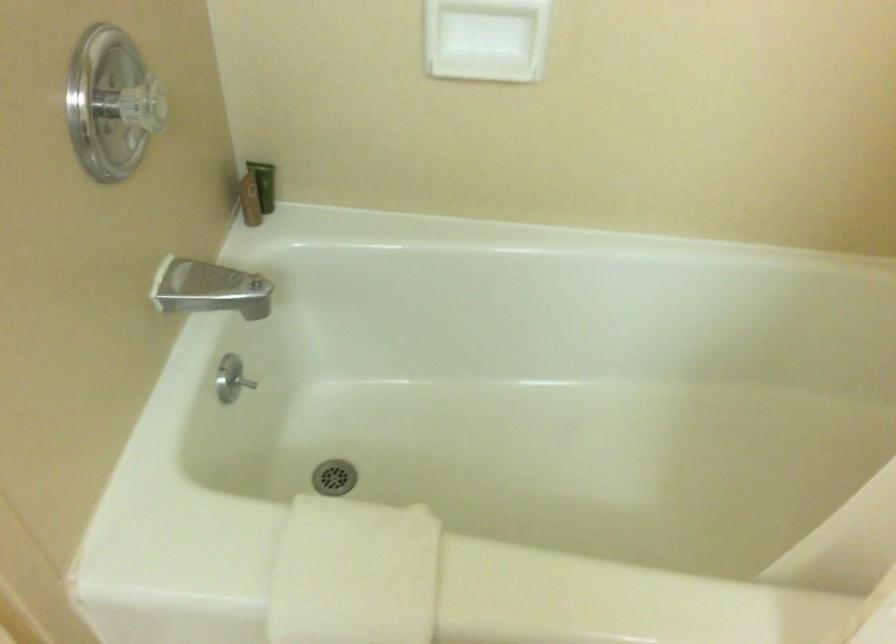
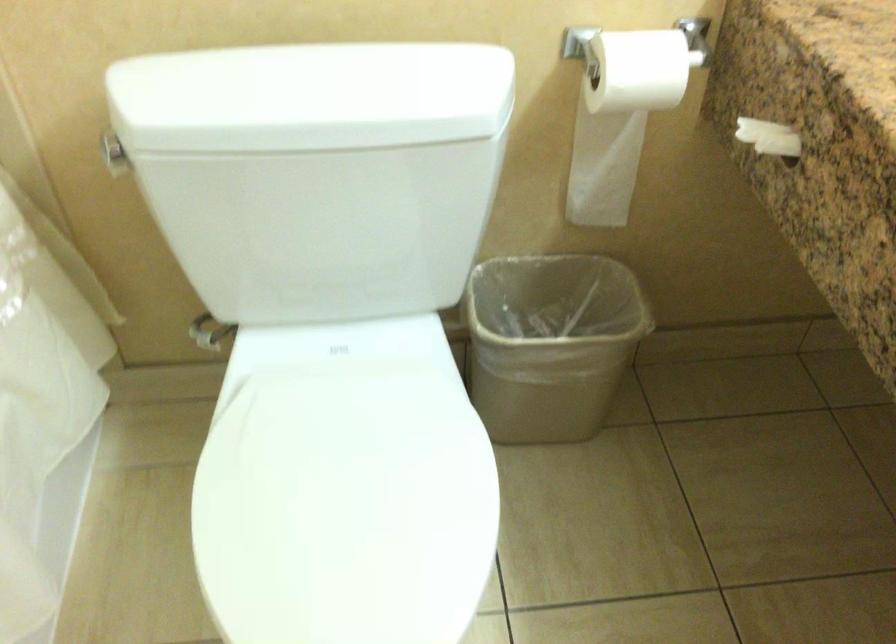
How did the camera likely rotate?

The camera's rotation is toward right-down.